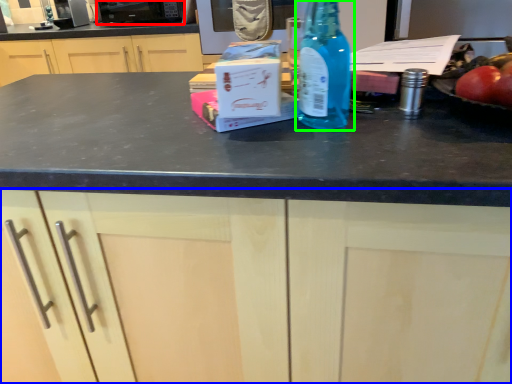
Question: Which is farther away from appliance (highlighted by a red box)? cabinetry (highlighted by a blue box) or bottle (highlighted by a green box)?

Choices:
 (A) cabinetry
 (B) bottle

Answer: (A)